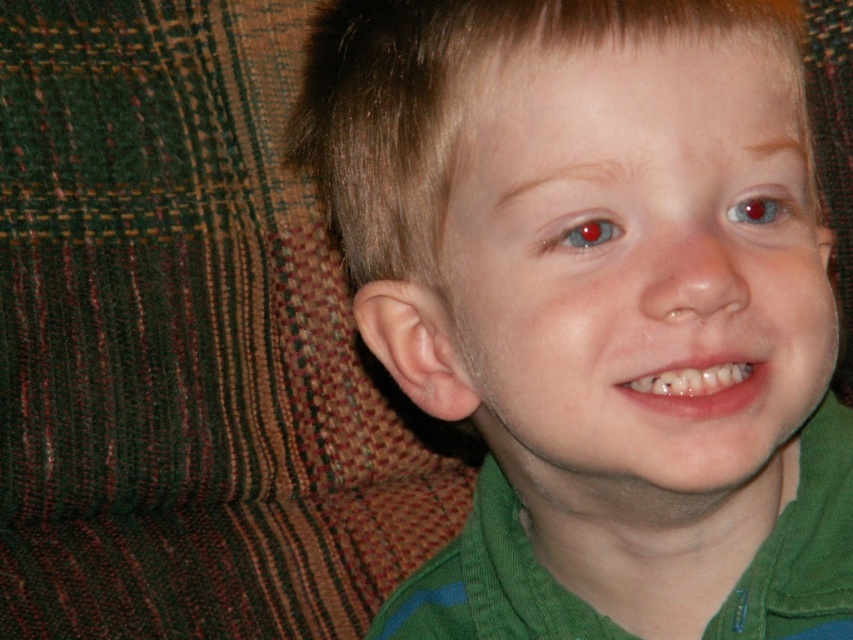
Question: Can you confirm if green corduroy shirt at center is smaller than red glossy eye at upper center?

Choices:
 (A) yes
 (B) no

Answer: (B)

Question: Which of the following is the closest to the observer?

Choices:
 (A) (780, 198)
 (B) (575, 244)

Answer: (B)

Question: Is green corduroy shirt at center above red glossy eye at upper center?

Choices:
 (A) no
 (B) yes

Answer: (A)

Question: Which point is closer to the camera?

Choices:
 (A) green corduroy shirt at center
 (B) red glossy eye at upper center

Answer: (A)

Question: Where is glossy blue eye at upper center located in relation to red glossy eye at upper center in the image?

Choices:
 (A) right
 (B) left

Answer: (B)

Question: Which point is farther to the camera?

Choices:
 (A) (741, 216)
 (B) (541, 246)
 (C) (848, 472)

Answer: (C)